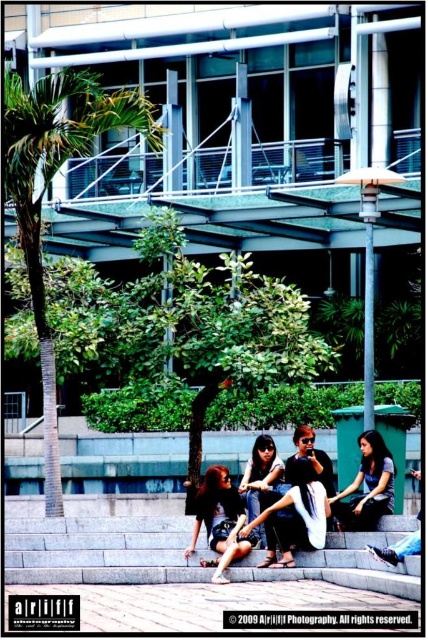
You are a photographer trying to capture a candid shot of the scene. You notice the matte black laptop at center and the matte black hair at center. Which object is taller from the perspective of your camera lens?

The matte black hair at center is taller than the matte black laptop at center.

You are a photographer trying to capture a group photo of the four individuals sitting on the stone steps. Considering the green leafy palm tree at left and the matte black hair at center, which object would appear bigger in your photo?

The green leafy palm tree at left appears bigger in the photo because it is larger in size than the matte black hair at center.

You are standing in front of the modern building with the group of people. If you want to get a better view of the matte black hair at center, should you move to the left or right of the green leafy palm tree at left?

The green leafy palm tree at left is to the left of matte black hair at center. To get a better view of the matte black hair at center, you should move to the right of the green leafy palm tree at left so that the palm tree is no longer blocking your view.